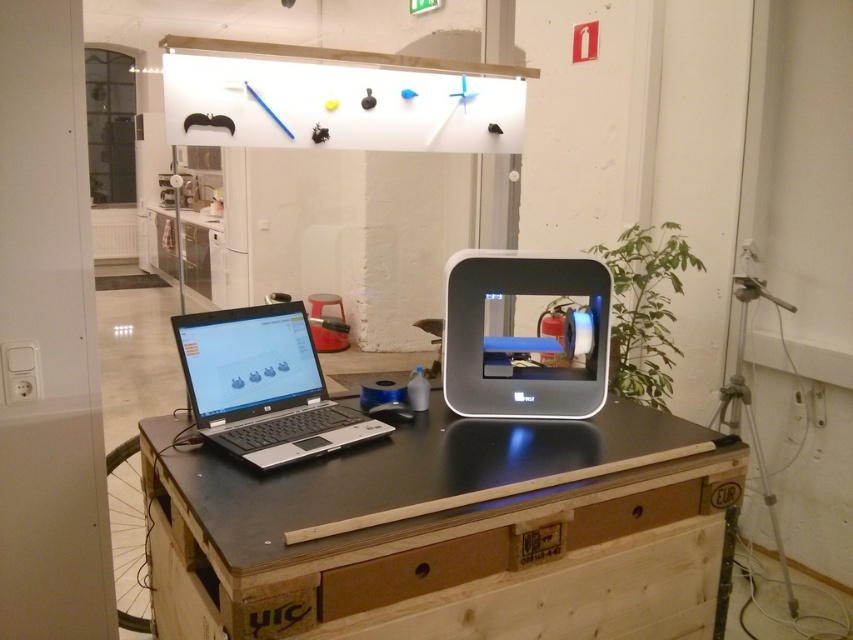
You are a delivery robot with a height of 1.2 meters. You need to place a package on the black matte table at center. Can you reach the table without bending down?

The black matte table at center is 1.13 meters away from the viewer. Since the robot is 1.2 meters tall, it can reach the table without bending down as its height exceeds the table distance.

You are a visitor in the maker space and want to place a tool on the closest object to you. Which object should you choose between the black matte table at center and the black matte laptop at left?

The black matte table at center is closer to the viewer than the black matte laptop at left, so you should place the tool on the black matte table at center.